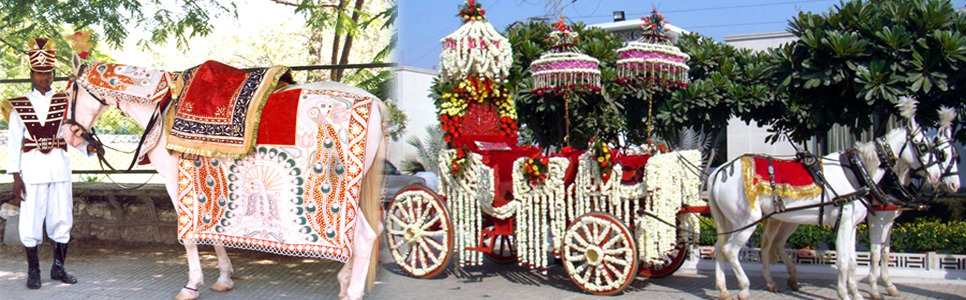
Where is `seats`? This screenshot has width=966, height=300. seats is located at coordinates (506, 174), (628, 168).